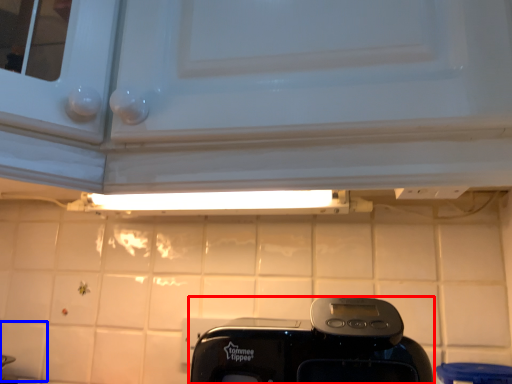
Question: Which object appears farthest to the camera in this image, home appliance (highlighted by a red box) or tile (highlighted by a blue box)?

Choices:
 (A) home appliance
 (B) tile

Answer: (B)